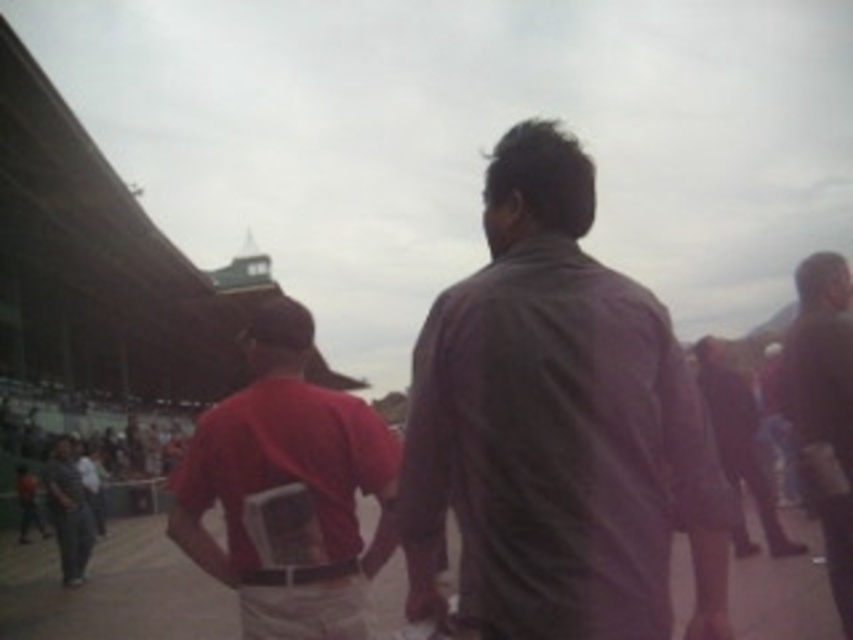
Question: Is matte red shirt at center bigger than brown matte shirt at center?

Choices:
 (A) yes
 (B) no

Answer: (A)

Question: Which point is closer to the camera?

Choices:
 (A) (67, 518)
 (B) (850, 324)
 (C) (775, 556)

Answer: (B)

Question: Can you confirm if brown matte shirt at center is smaller than dark gray fabric pants at lower left?

Choices:
 (A) yes
 (B) no

Answer: (A)

Question: Which object is closer to the camera taking this photo?

Choices:
 (A) matte red shirt at center
 (B) dark brown shirt at center
 (C) dark brown leather jacket at center

Answer: (B)

Question: Can you confirm if dark brown leather jacket at center is positioned below dark gray fabric pants at lower left?

Choices:
 (A) no
 (B) yes

Answer: (A)

Question: Which of the following is the farthest from the observer?

Choices:
 (A) (277, 349)
 (B) (717, 348)
 (C) (836, 525)

Answer: (B)